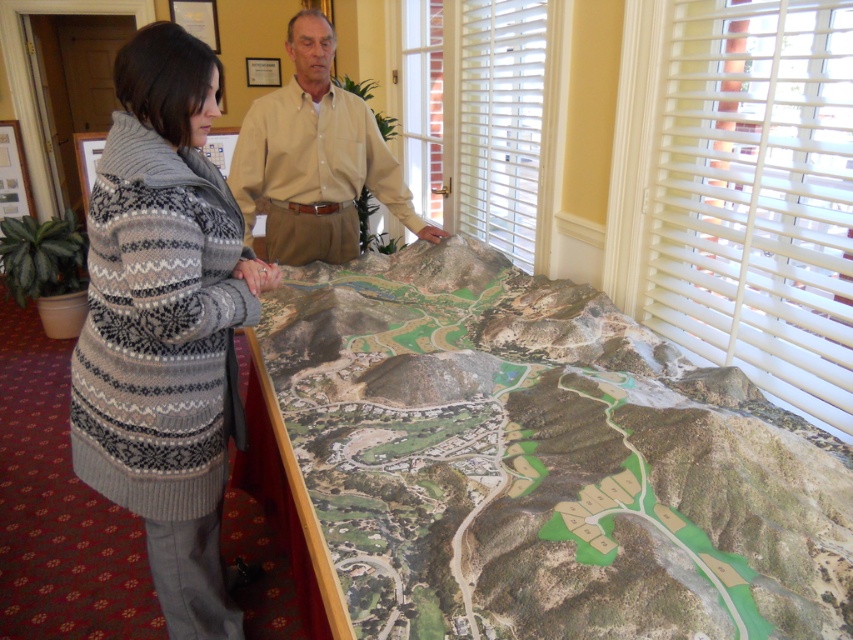
You are a visitor in the room and want to know if the green textured map at center is taller than the white wood blinds at upper right. Based on the scene, can you determine which one is taller?

The green textured map at center is shorter than the white wood blinds at upper right, so the white wood blinds at upper right are taller.

You are a visitor at an exhibition and see the knitted wool coat at left and the white plastic blinds at upper right in the image. Which object is closer to the left edge of the image?

The knitted wool coat at left is closer to the left edge of the image because it is positioned to the left of the white plastic blinds at upper right.

You are an interior designer observing the scene. You need to adjust the lighting in the room to highlight the beige cotton shirt at upper center without affecting the white plastic blinds at upper right. Is this possible based on their positions?

The white plastic blinds at upper right is positioned under beige cotton shirt at upper center, so adjusting the lighting to highlight the beige cotton shirt at upper center without affecting the white plastic blinds at upper right is possible by directing light towards the upper center area where the shirt is located, avoiding the lower position of the blinds.